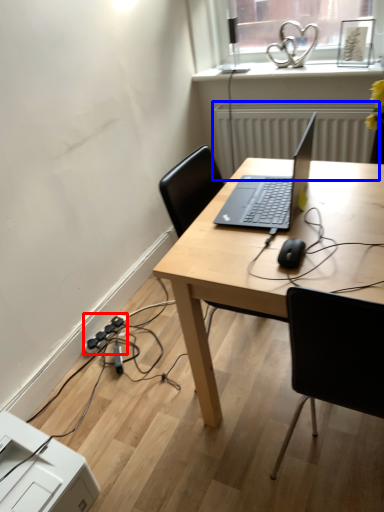
Question: Which of the following is the closest to the observer, extension cord (highlighted by a red box) or radiator (highlighted by a blue box)?

Choices:
 (A) extension cord
 (B) radiator

Answer: (A)